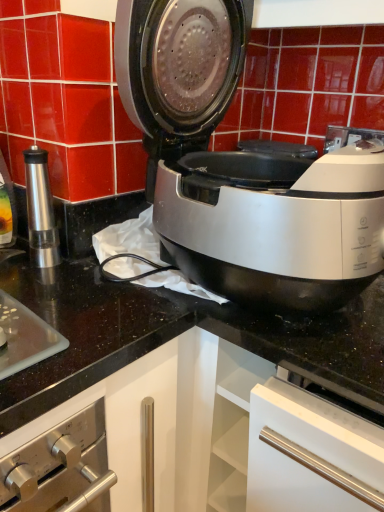
Question: Considering the positions of point (195, 97) and point (49, 205), is point (195, 97) closer or farther from the camera than point (49, 205)?

Choices:
 (A) closer
 (B) farther

Answer: (A)

Question: Choose the correct answer: Is satin silver air fryer at center inside metallic silver pepper grinder at left or outside it?

Choices:
 (A) outside
 (B) inside

Answer: (A)

Question: From a real-world perspective, is satin silver air fryer at center above or below metallic silver pepper grinder at left?

Choices:
 (A) above
 (B) below

Answer: (A)

Question: Looking at their shapes, would you say metallic silver pepper grinder at left is wider or thinner than satin silver air fryer at center?

Choices:
 (A) thin
 (B) wide

Answer: (A)

Question: In terms of height, does metallic silver pepper grinder at left look taller or shorter compared to satin silver air fryer at center?

Choices:
 (A) tall
 (B) short

Answer: (B)

Question: From the image's perspective, is metallic silver pepper grinder at left located above or below satin silver air fryer at center?

Choices:
 (A) above
 (B) below

Answer: (B)

Question: Visually, is metallic silver pepper grinder at left positioned to the left or to the right of satin silver air fryer at center?

Choices:
 (A) right
 (B) left

Answer: (B)